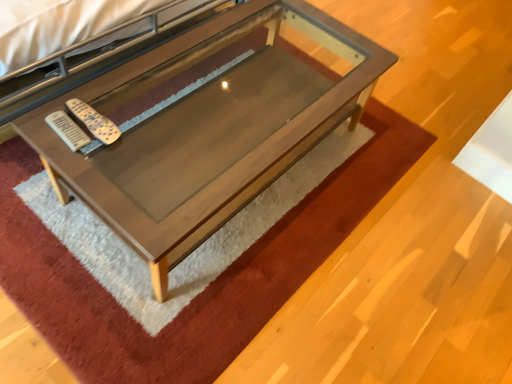
Describe the element at coordinates (209, 130) in the screenshot. The image size is (512, 384). I see `wooden table at center` at that location.

Identify the location of white plastic remote at left, marked as the second remote in a right-to-left arrangement. This screenshot has width=512, height=384. (68, 130).

Considering the points (73, 134) and (76, 171), which point is behind, point (73, 134) or point (76, 171)?

The point (73, 134) is farther from the camera.

Are white plastic remote at left, marked as the second remote in a right-to-left arrangement, and wooden table at center making contact?

They are not placed beside each other.

From the image's perspective, which one is positioned higher, white plastic remote at left, placed as the 1th remote when sorted from left to right, or wooden table at center?

wooden table at center, from the image's perspective.

Is white plastic remote at left, placed as the 1th remote when sorted from left to right, wider than wooden table at center?

Incorrect, the width of white plastic remote at left, placed as the 1th remote when sorted from left to right, does not surpass that of wooden table at center.

Considering the relative sizes of wooden table at center and white plastic remote at left, placed as the 1th remote when sorted from left to right, in the image provided, is wooden table at center wider than white plastic remote at left, placed as the 1th remote when sorted from left to right,?

Yes, wooden table at center is wider than white plastic remote at left, placed as the 1th remote when sorted from left to right.

In the scene shown: Could you tell me if wooden table at center is facing white plastic remote at left, placed as the 1th remote when sorted from left to right?

No.

Are wooden table at center and white plastic remote at left, marked as the second remote in a right-to-left arrangement, making contact?

They are not placed beside each other.

Between wooden table at center and white plastic remote at left, placed as the 1th remote when sorted from left to right, which one appears on the right side from the viewer's perspective?

wooden table at center.

This screenshot has width=512, height=384. Identify the location of table located in front of the white plastic remote at center-left, placed as the 1th remote when sorted from right to left. (209, 130).

How many degrees apart are the facing directions of wooden table at center and white plastic remote at center-left, which is the 2th remote from left to right?

0.0133 degrees separate the facing orientations of wooden table at center and white plastic remote at center-left, which is the 2th remote from left to right.

Which object is wider, wooden table at center or white plastic remote at center-left, placed as the 1th remote when sorted from right to left?

With larger width is wooden table at center.

Who is bigger, white plastic remote at center-left, placed as the 1th remote when sorted from right to left, or wooden table at center?

With larger size is wooden table at center.

Considering the sizes of white plastic remote at center-left, which is the 2th remote from left to right, and wooden table at center in the image, is white plastic remote at center-left, which is the 2th remote from left to right, taller or shorter than wooden table at center?

Clearly, white plastic remote at center-left, which is the 2th remote from left to right, is shorter compared to wooden table at center.

Is white plastic remote at center-left, which is the 2th remote from left to right, facing towards wooden table at center?

No, white plastic remote at center-left, which is the 2th remote from left to right, is not turned towards wooden table at center.

Which object is closer to the camera, white plastic remote at center-left, placed as the 1th remote when sorted from right to left, or white plastic remote at left, placed as the 1th remote when sorted from left to right?

white plastic remote at left, placed as the 1th remote when sorted from left to right, is closer to the camera.

Is white plastic remote at center-left, placed as the 1th remote when sorted from right to left, in contact with white plastic remote at left, placed as the 1th remote when sorted from left to right?

Yes, white plastic remote at center-left, placed as the 1th remote when sorted from right to left, is in contact with white plastic remote at left, placed as the 1th remote when sorted from left to right.

Is white plastic remote at center-left, placed as the 1th remote when sorted from right to left, oriented towards white plastic remote at left, marked as the second remote in a right-to-left arrangement?

No, white plastic remote at center-left, placed as the 1th remote when sorted from right to left, is not oriented towards white plastic remote at left, marked as the second remote in a right-to-left arrangement.

Is white plastic remote at left, marked as the second remote in a right-to-left arrangement, oriented away from white plastic remote at center-left, which is the 2th remote from left to right?

That's not correct — white plastic remote at left, marked as the second remote in a right-to-left arrangement, is not looking away from white plastic remote at center-left, which is the 2th remote from left to right.

In the image, is white plastic remote at left, marked as the second remote in a right-to-left arrangement, on the left side or the right side of white plastic remote at center-left, which is the 2th remote from left to right?

Clearly, white plastic remote at left, marked as the second remote in a right-to-left arrangement, is on the left of white plastic remote at center-left, which is the 2th remote from left to right, in the image.

From the picture: In the image, is white plastic remote at left, marked as the second remote in a right-to-left arrangement, positioned in front of or behind white plastic remote at center-left, which is the 2th remote from left to right?

Clearly, white plastic remote at left, marked as the second remote in a right-to-left arrangement, is in front of white plastic remote at center-left, which is the 2th remote from left to right.

From the image's perspective, would you say white plastic remote at left, marked as the second remote in a right-to-left arrangement, is positioned over white plastic remote at center-left, which is the 2th remote from left to right?

No, from the image's perspective, white plastic remote at left, marked as the second remote in a right-to-left arrangement, is not on top of white plastic remote at center-left, which is the 2th remote from left to right.

Which remote is the 2nd one when counting from the left side of the wooden table at center? Please provide its 2D coordinates.

[(68, 130)]

The width and height of the screenshot is (512, 384). What are the coordinates of `the 1st remote directly above the wooden table at center (from a real-world perspective)` in the screenshot? It's located at (68, 130).

From the image, which object appears to be nearer to white plastic remote at center-left, which is the 2th remote from left to right, wooden table at center or white plastic remote at left, placed as the 1th remote when sorted from left to right?

Among the two, white plastic remote at left, placed as the 1th remote when sorted from left to right, is located nearer to white plastic remote at center-left, which is the 2th remote from left to right.

Which object lies nearer to the anchor point white plastic remote at left, placed as the 1th remote when sorted from left to right, wooden table at center or white plastic remote at center-left, placed as the 1th remote when sorted from right to left?

white plastic remote at center-left, placed as the 1th remote when sorted from right to left, is positioned closer to the anchor white plastic remote at left, placed as the 1th remote when sorted from left to right.

Based on their spatial positions, is white plastic remote at left, marked as the second remote in a right-to-left arrangement, or wooden table at center further from white plastic remote at center-left, which is the 2th remote from left to right?

wooden table at center is positioned further to the anchor white plastic remote at center-left, which is the 2th remote from left to right.

Which object lies nearer to the anchor point wooden table at center, white plastic remote at left, marked as the second remote in a right-to-left arrangement, or white plastic remote at center-left, placed as the 1th remote when sorted from right to left?

white plastic remote at center-left, placed as the 1th remote when sorted from right to left, is closer to wooden table at center.

Looking at the image, which one is located closer to white plastic remote at left, placed as the 1th remote when sorted from left to right, white plastic remote at center-left, placed as the 1th remote when sorted from right to left, or wooden table at center?

Among the two, white plastic remote at center-left, placed as the 1th remote when sorted from right to left, is located nearer to white plastic remote at left, placed as the 1th remote when sorted from left to right.

Which object lies further to the anchor point wooden table at center, white plastic remote at center-left, placed as the 1th remote when sorted from right to left, or white plastic remote at left, marked as the second remote in a right-to-left arrangement?

white plastic remote at left, marked as the second remote in a right-to-left arrangement, is further to wooden table at center.

Identify the location of remote between white plastic remote at left, marked as the second remote in a right-to-left arrangement, and wooden table at center, in the horizontal direction. The image size is (512, 384). (94, 121).